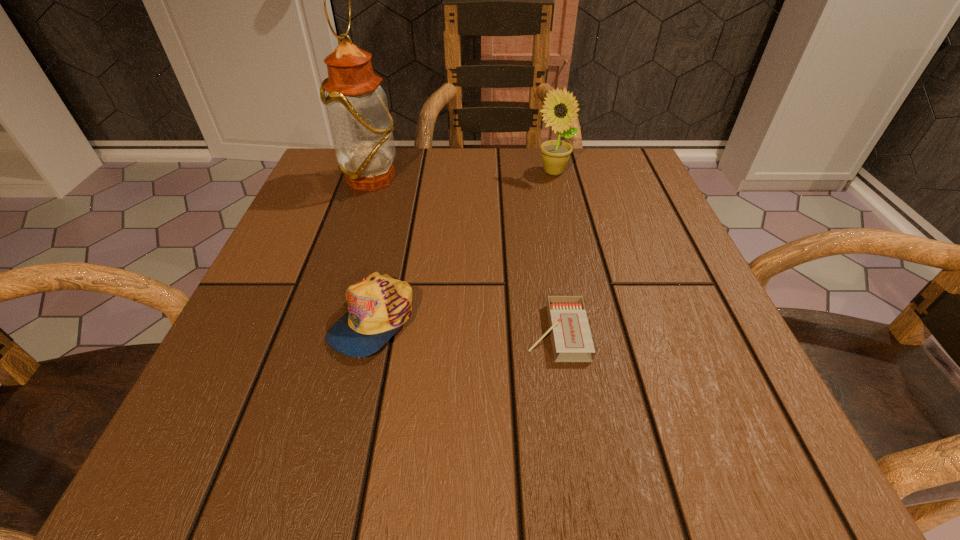
Where is `vacant area at the near left corner`? This screenshot has width=960, height=540. vacant area at the near left corner is located at coordinates (288, 418).

You are a GUI agent. You are given a task and a screenshot of the screen. Output one action in this format:
    pyautogui.click(x=<x>, y=<y>)
    Task: Click on the vacant space at the far right corner of the desktop
    
    Given the screenshot: What is the action you would take?
    pyautogui.click(x=594, y=174)

Identify the location of free spot between the tallest object and the shortest object. point(464,256).

You are a GUI agent. You are given a task and a screenshot of the screen. Output one action in this format:
    pyautogui.click(x=<x>, y=<y>)
    Task: Click on the blank region between the shortest object and the tallest object
    This screenshot has height=540, width=960.
    Given the screenshot: What is the action you would take?
    pyautogui.click(x=464, y=256)

Locate an element on the screen. The image size is (960, 540). free point between the third shortest object and the shortest object is located at coordinates pos(555,252).

Find the location of a particular element. Image resolution: width=960 pixels, height=540 pixels. free space between the tallest object and the second shortest object is located at coordinates (372, 249).

Identify the location of free area in between the shortest object and the second shortest object. (465, 326).

In order to click on vacant point located between the sunflower and the tallest object in this screenshot , I will do `click(463, 176)`.

Where is `vacant area between the second shortest object and the second tallest object`? vacant area between the second shortest object and the second tallest object is located at coordinates (463, 246).

Where is `free space between the shortest object and the oil lamp`? free space between the shortest object and the oil lamp is located at coordinates (464, 256).